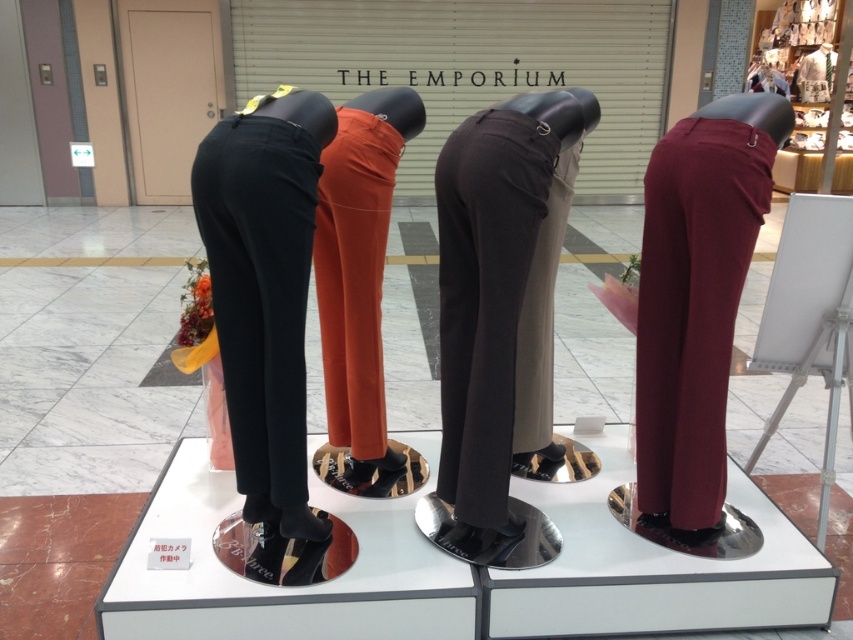
Question: Which point is closer to the camera taking this photo?

Choices:
 (A) (737, 225)
 (B) (439, 456)

Answer: (A)

Question: Estimate the real-world distances between objects in this image. Which object is closer to the burgundy smooth pants at right?

Choices:
 (A) dark gray trousers at center
 (B) orange cotton pants at center
 (C) matte black trousers at left

Answer: (A)

Question: Is burgundy smooth pants at right wider than matte black trousers at left?

Choices:
 (A) no
 (B) yes

Answer: (B)

Question: Which of the following is the farthest from the observer?

Choices:
 (A) (332, 284)
 (B) (637, 364)
 (C) (466, 328)
 (D) (296, 385)

Answer: (A)

Question: Is the position of dark gray trousers at center more distant than that of orange cotton pants at center?

Choices:
 (A) no
 (B) yes

Answer: (A)

Question: Where is burgundy smooth pants at right located in relation to dark gray trousers at center in the image?

Choices:
 (A) right
 (B) left

Answer: (A)